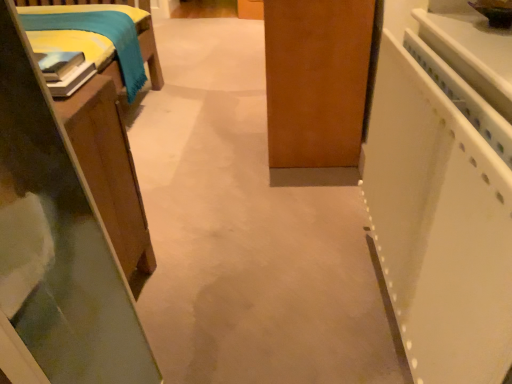
Image resolution: width=512 pixels, height=384 pixels. Describe the element at coordinates (86, 54) in the screenshot. I see `wooden bed frame at left, the 1th furniture viewed from the top` at that location.

Measure the distance between point (123,101) and camera.

Point (123,101) is 1.73 meters from camera.

The width and height of the screenshot is (512, 384). I want to click on wooden table at left, positioned as the first furniture in bottom-to-top order, so click(55, 247).

Locate an element on the screen. The height and width of the screenshot is (384, 512). white plastic cabinet at right is located at coordinates (441, 215).

The width and height of the screenshot is (512, 384). Find the location of `wooden bed frame at left, the second furniture from the bottom`. wooden bed frame at left, the second furniture from the bottom is located at coordinates (86, 54).

Considering the relative sizes of wooden bed frame at left, the 1th furniture viewed from the top, and white glossy counter top at right in the image provided, is wooden bed frame at left, the 1th furniture viewed from the top, wider than white glossy counter top at right?

Incorrect, the width of wooden bed frame at left, the 1th furniture viewed from the top, does not surpass that of white glossy counter top at right.

The image size is (512, 384). Identify the location of counter top in front of the wooden bed frame at left, the second furniture from the bottom. (464, 54).

Which object is more forward, wooden bed frame at left, the second furniture from the bottom, or white glossy counter top at right?

white glossy counter top at right.

Can you tell me how much wooden bed frame at left, the second furniture from the bottom, and white glossy counter top at right differ in facing direction?

They differ by 91.4 degrees in their facing directions.

Can you confirm if white glossy counter top at right is taller than white plastic cabinet at right?

No.

Who is smaller, white glossy counter top at right or white plastic cabinet at right?

Smaller between the two is white glossy counter top at right.

From the image's perspective, which one is positioned higher, white glossy counter top at right or white plastic cabinet at right?

white glossy counter top at right appears higher in the image.

Consider the image. Is white glossy counter top at right far from white plastic cabinet at right?

No, white glossy counter top at right is not far from white plastic cabinet at right.

From the image's perspective, is white plastic cabinet at right located above or below white glossy counter top at right?

Based on their image positions, white plastic cabinet at right is located beneath white glossy counter top at right.

From a real-world perspective, is white plastic cabinet at right physically below white glossy counter top at right?

Yes, from a real-world perspective, white plastic cabinet at right is beneath white glossy counter top at right.

Is white plastic cabinet at right not inside white glossy counter top at right?

Yes, white plastic cabinet at right is not within white glossy counter top at right.

Which object is closer to the camera, white plastic cabinet at right or white glossy counter top at right?

white plastic cabinet at right is in front.

From the image's perspective, is white plastic cabinet at right under wooden bed frame at left, the 1th furniture viewed from the top?

Yes, from the image's perspective, white plastic cabinet at right is beneath wooden bed frame at left, the 1th furniture viewed from the top.

Is white plastic cabinet at right positioned with its back to wooden bed frame at left, the 1th furniture viewed from the top?

No, white plastic cabinet at right's orientation is not away from wooden bed frame at left, the 1th furniture viewed from the top.

Considering the relative sizes of white plastic cabinet at right and wooden bed frame at left, the second furniture from the bottom, in the image provided, is white plastic cabinet at right bigger than wooden bed frame at left, the second furniture from the bottom,?

Indeed, white plastic cabinet at right has a larger size compared to wooden bed frame at left, the second furniture from the bottom.

From a real-world perspective, is white plastic cabinet at right beneath wooden bed frame at left, the second furniture from the bottom?

Indeed, from a real-world perspective, white plastic cabinet at right is positioned beneath wooden bed frame at left, the second furniture from the bottom.

Does wooden table at left, which is counted as the 2th furniture, starting from the top, have a lesser height compared to white glossy counter top at right?

No, wooden table at left, which is counted as the 2th furniture, starting from the top, is not shorter than white glossy counter top at right.

Between point (20, 374) and point (479, 73), which one is positioned in front?

Point (20, 374)

Is wooden table at left, which is counted as the 2th furniture, starting from the top, looking in the opposite direction of white glossy counter top at right?

No, white glossy counter top at right is not at the back of wooden table at left, which is counted as the 2th furniture, starting from the top.

From the image's perspective, is wooden table at left, which is counted as the 2th furniture, starting from the top, under white glossy counter top at right?

Indeed, from the image's perspective, wooden table at left, which is counted as the 2th furniture, starting from the top, is shown beneath white glossy counter top at right.

In the scene shown: Is there a large distance between wooden table at left, positioned as the first furniture in bottom-to-top order, and white plastic cabinet at right?

wooden table at left, positioned as the first furniture in bottom-to-top order, is actually quite close to white plastic cabinet at right.

Considering the relative positions of wooden table at left, which is counted as the 2th furniture, starting from the top, and white plastic cabinet at right in the image provided, is wooden table at left, which is counted as the 2th furniture, starting from the top, behind white plastic cabinet at right?

Yes, wooden table at left, which is counted as the 2th furniture, starting from the top, is behind white plastic cabinet at right.

Is point (126, 354) positioned behind point (454, 137)?

That is True.

Can you tell me how much white plastic cabinet at right and wooden table at left, which is counted as the 2th furniture, starting from the top, differ in facing direction?

There is a 91.8-degree angle between the facing directions of white plastic cabinet at right and wooden table at left, which is counted as the 2th furniture, starting from the top.

Considering the positions of objects white plastic cabinet at right and wooden table at left, positioned as the first furniture in bottom-to-top order, in the image provided, who is behind, white plastic cabinet at right or wooden table at left, positioned as the first furniture in bottom-to-top order,?

wooden table at left, positioned as the first furniture in bottom-to-top order, is behind.

Where is `appliance lying above the wooden table at left, which is counted as the 2th furniture, starting from the top (from the image's perspective)`? Image resolution: width=512 pixels, height=384 pixels. appliance lying above the wooden table at left, which is counted as the 2th furniture, starting from the top (from the image's perspective) is located at coordinates (441, 215).

Can you confirm if white plastic cabinet at right is thinner than wooden table at left, which is counted as the 2th furniture, starting from the top?

Yes, white plastic cabinet at right is thinner than wooden table at left, which is counted as the 2th furniture, starting from the top.

Find the location of a particular element. Image resolution: width=512 pixels, height=384 pixels. counter top beneath the wooden bed frame at left, the second furniture from the bottom (from a real-world perspective) is located at coordinates (464, 54).

Find the location of `appliance in front of the white glossy counter top at right`. appliance in front of the white glossy counter top at right is located at coordinates (441, 215).

Estimate the real-world distances between objects in this image. Which object is closer to white plastic cabinet at right, wooden table at left, which is counted as the 2th furniture, starting from the top, or wooden bed frame at left, the second furniture from the bottom?

wooden table at left, which is counted as the 2th furniture, starting from the top.

In the scene shown: Estimate the real-world distances between objects in this image. Which object is closer to white glossy counter top at right, wooden table at left, which is counted as the 2th furniture, starting from the top, or wooden bed frame at left, the second furniture from the bottom?

wooden table at left, which is counted as the 2th furniture, starting from the top, lies closer to white glossy counter top at right than the other object.

From the image, which object appears to be farther from wooden bed frame at left, the 1th furniture viewed from the top, white glossy counter top at right or white plastic cabinet at right?

Among the two, white glossy counter top at right is located further to wooden bed frame at left, the 1th furniture viewed from the top.

When comparing their distances from white glossy counter top at right, does wooden table at left, positioned as the first furniture in bottom-to-top order, or white plastic cabinet at right seem further?

wooden table at left, positioned as the first furniture in bottom-to-top order, is further to white glossy counter top at right.

Based on their spatial positions, is wooden table at left, which is counted as the 2th furniture, starting from the top, or white glossy counter top at right closer to white plastic cabinet at right?

white glossy counter top at right is positioned closer to the anchor white plastic cabinet at right.

From the image, which object appears to be nearer to white plastic cabinet at right, wooden bed frame at left, the second furniture from the bottom, or white glossy counter top at right?

Based on the image, white glossy counter top at right appears to be nearer to white plastic cabinet at right.

From the picture: When comparing their distances from wooden table at left, which is counted as the 2th furniture, starting from the top, does white glossy counter top at right or white plastic cabinet at right seem closer?

white plastic cabinet at right lies closer to wooden table at left, which is counted as the 2th furniture, starting from the top, than the other object.

Estimate the real-world distances between objects in this image. Which object is further from white plastic cabinet at right, wooden bed frame at left, the second furniture from the bottom, or wooden table at left, positioned as the first furniture in bottom-to-top order?

The object further to white plastic cabinet at right is wooden bed frame at left, the second furniture from the bottom.

Where is `appliance between wooden table at left, which is counted as the 2th furniture, starting from the top, and white glossy counter top at right from left to right`? appliance between wooden table at left, which is counted as the 2th furniture, starting from the top, and white glossy counter top at right from left to right is located at coordinates (441, 215).

Locate an element on the screen. The width and height of the screenshot is (512, 384). appliance situated between wooden bed frame at left, the second furniture from the bottom, and white glossy counter top at right from left to right is located at coordinates (441, 215).

Locate an element on the screen. furniture situated between wooden table at left, which is counted as the 2th furniture, starting from the top, and white glossy counter top at right from left to right is located at coordinates (86, 54).

Locate an element on the screen. furniture between wooden table at left, which is counted as the 2th furniture, starting from the top, and white plastic cabinet at right, in the horizontal direction is located at coordinates (86, 54).